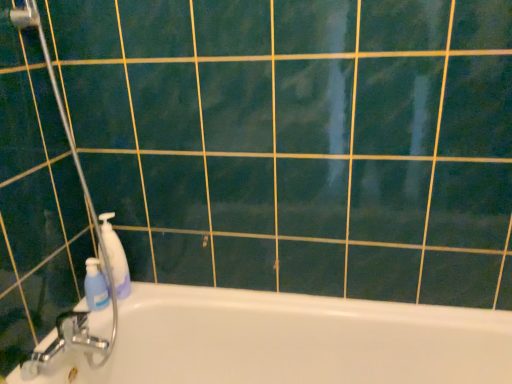
Question: Considering the positions of blue plastic bottle at left, arranged as the 2th cleaning product when viewed from the right, and white glossy bathtub at lower left in the image, is blue plastic bottle at left, arranged as the 2th cleaning product when viewed from the right, wider or thinner than white glossy bathtub at lower left?

Choices:
 (A) thin
 (B) wide

Answer: (A)

Question: Considering their positions, is blue plastic bottle at left, arranged as the 2th cleaning product when viewed from the right, located in front of or behind white glossy bathtub at lower left?

Choices:
 (A) front
 (B) behind

Answer: (B)

Question: Based on their relative distances, which object is nearer to the white glossy bathtub at lower left?

Choices:
 (A) blue plastic pump bottle at left, which is the 1th cleaning product from right to left
 (B) transparent plastic shower door at left
 (C) blue plastic bottle at left, arranged as the 2th cleaning product when viewed from the right

Answer: (A)

Question: Estimate the real-world distances between objects in this image. Which object is farther from the transparent plastic shower door at left?

Choices:
 (A) blue plastic pump bottle at left, which is the 1th cleaning product from right to left
 (B) blue plastic bottle at left, arranged as the 2th cleaning product when viewed from the right
 (C) white glossy bathtub at lower left

Answer: (C)